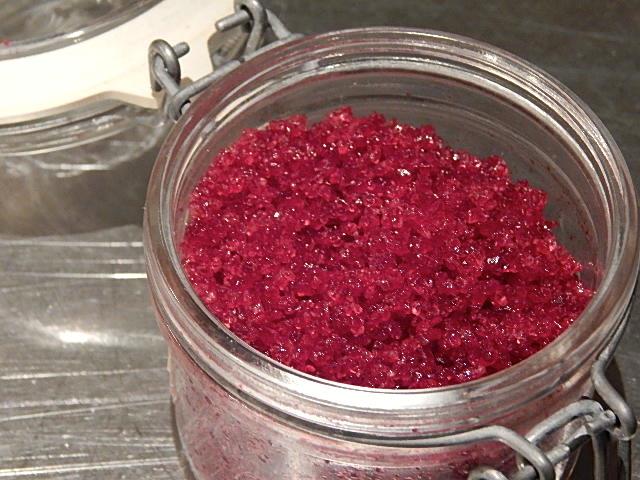
You are a GUI agent. You are given a task and a screenshot of the screen. Output one action in this format:
    pyautogui.click(x=<x>, y=<y>)
    Task: Click on the upper area of table top.inside of jar lip
    
    Given the screenshot: What is the action you would take?
    pyautogui.click(x=566, y=35), pyautogui.click(x=483, y=79)